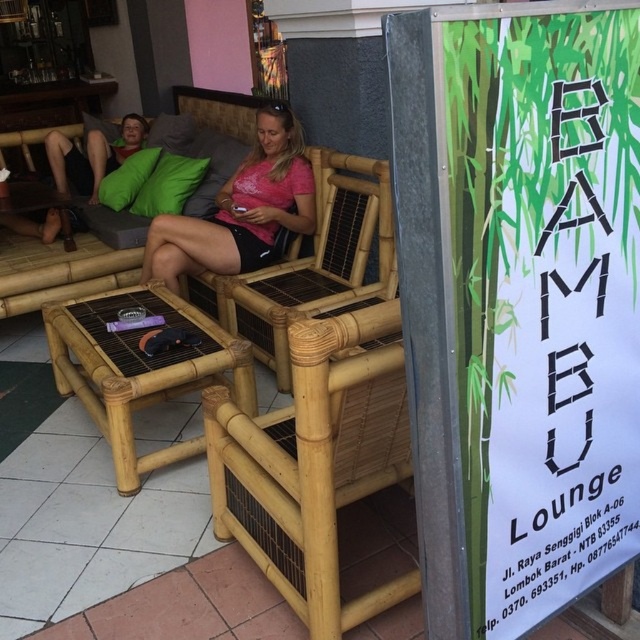
Question: Considering the real-world distances, which object is closest to the matte pink shirt at center?

Choices:
 (A) bamboo woven chair at center
 (B) bamboo stool at center

Answer: (A)

Question: Is natural bamboo chair at center bigger than matte pink shirt at center?

Choices:
 (A) no
 (B) yes

Answer: (A)

Question: Does natural bamboo chair at center lie behind bamboo woven chair at center?

Choices:
 (A) no
 (B) yes

Answer: (A)

Question: Based on their relative distances, which object is farther from the natural bamboo chair at center?

Choices:
 (A) matte pink shirt at center
 (B) bamboo stool at center
 (C) bamboo woven chair at center

Answer: (A)

Question: In this image, where is bamboo stool at center located relative to bamboo woven chair at center?

Choices:
 (A) above
 (B) below

Answer: (B)

Question: Which point appears closest to the camera in this image?

Choices:
 (A) (131, 352)
 (B) (294, 296)
 (C) (156, 253)

Answer: (A)